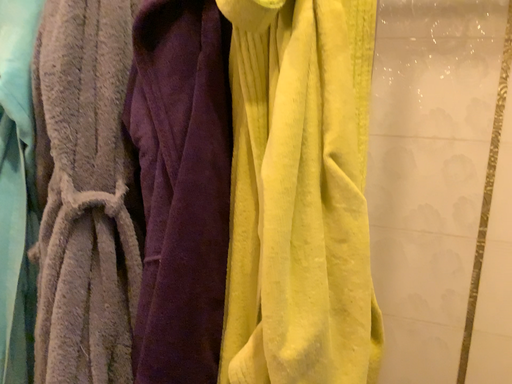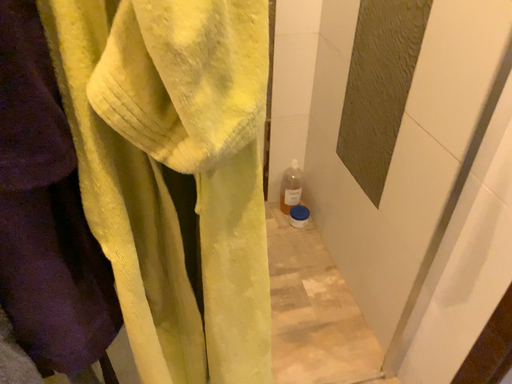
Question: Which way did the camera rotate in the video?

Choices:
 (A) rotated downward
 (B) rotated upward

Answer: (A)